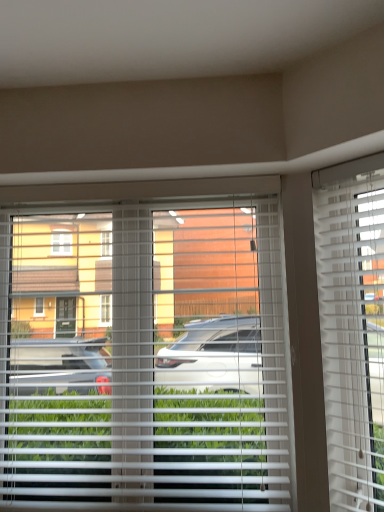
Question: Is white plastic blinds at center, which is the 1th window blind in left-to-right order, wider or thinner than white plastic blinds at right, placed as the 1th window blind when sorted from right to left?

Choices:
 (A) thin
 (B) wide

Answer: (B)

Question: Visually, is white plastic blinds at center, which appears as the 2th window blind when viewed from the right, positioned to the left or to the right of white plastic blinds at right, the second window blind in the left-to-right sequence?

Choices:
 (A) left
 (B) right

Answer: (A)

Question: Is point (177, 460) closer or farther from the camera than point (375, 249)?

Choices:
 (A) farther
 (B) closer

Answer: (A)

Question: From the image's perspective, is white plastic blinds at right, the second window blind in the left-to-right sequence, positioned above or below white plastic blinds at center, which is the 1th window blind in left-to-right order?

Choices:
 (A) above
 (B) below

Answer: (A)

Question: In terms of size, does white plastic blinds at right, placed as the 1th window blind when sorted from right to left, appear bigger or smaller than white plastic blinds at center, which is the 1th window blind in left-to-right order?

Choices:
 (A) big
 (B) small

Answer: (B)

Question: Does point (334, 508) appear closer or farther from the camera than point (127, 208)?

Choices:
 (A) farther
 (B) closer

Answer: (B)

Question: Do you think white plastic blinds at right, placed as the 1th window blind when sorted from right to left, is within white plastic blinds at center, which is the 1th window blind in left-to-right order, or outside of it?

Choices:
 (A) outside
 (B) inside

Answer: (A)